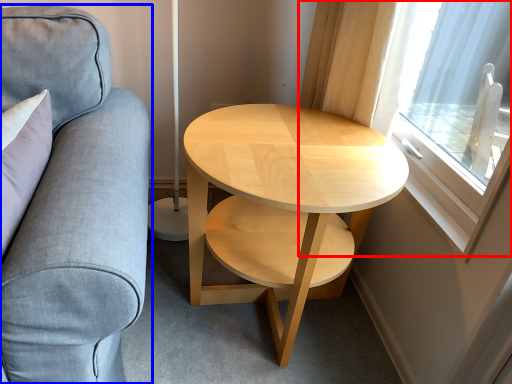
Question: Among these objects, which one is nearest to the camera, window (highlighted by a red box) or studio couch (highlighted by a blue box)?

Choices:
 (A) window
 (B) studio couch

Answer: (B)